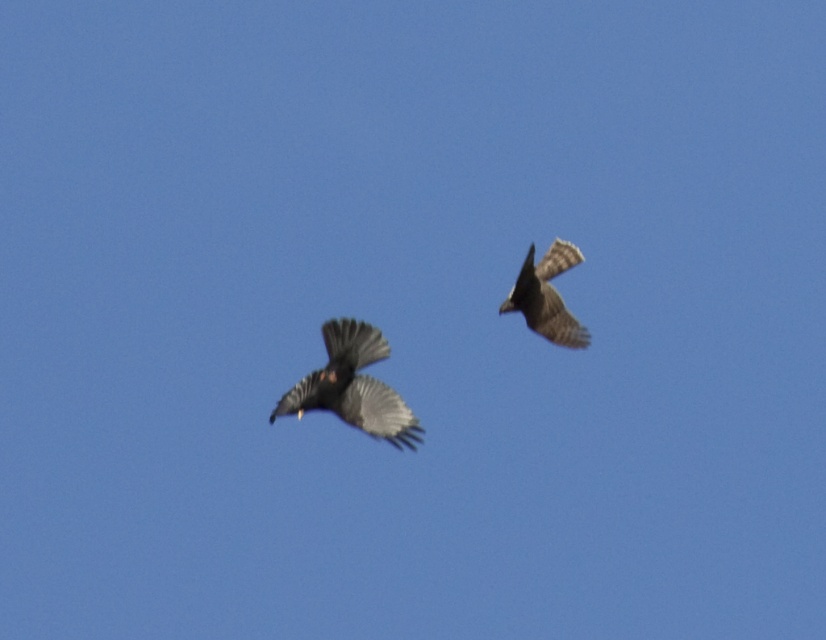
Question: Among these objects, which one is farthest from the camera?

Choices:
 (A) dark gray feathers at upper right
 (B) matte black crow at center

Answer: (B)

Question: Can you confirm if matte black crow at center is positioned to the right of dark gray feathers at upper right?

Choices:
 (A) yes
 (B) no

Answer: (B)

Question: Which point is farther to the camera?

Choices:
 (A) dark gray feathers at upper right
 (B) matte black crow at center

Answer: (B)

Question: Does matte black crow at center lie in front of dark gray feathers at upper right?

Choices:
 (A) yes
 (B) no

Answer: (B)

Question: Where is matte black crow at center located in relation to dark gray feathers at upper right in the image?

Choices:
 (A) above
 (B) below

Answer: (B)